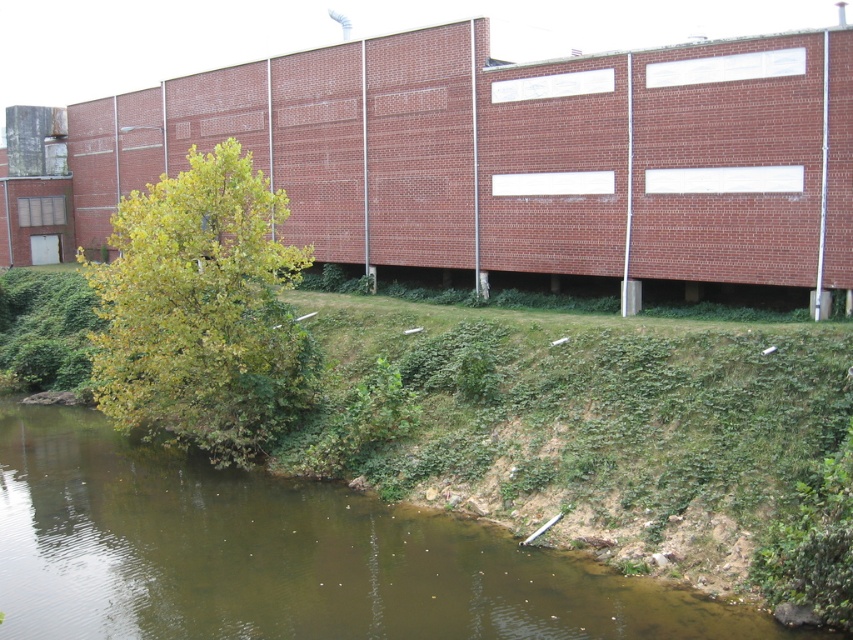
You are standing on the grassy embankment near the green leafy tree at lower left and want to walk to the green mossy river at lower left. Which direction should you go?

The green mossy river at lower left is located below the green leafy tree at lower left, so you should walk downward towards the river.

You are a maintenance worker needing to cross from the building to the green mossy river at lower left. There is a gap between the building and the green leafy tree at lower left. Can you safely jump across the gap to reach the river?

The distance between the green mossy river at lower left and the green leafy tree at lower left is 5.77 meters. Since the average human jump distance is around 2 meters, the gap is too wide to jump safely.